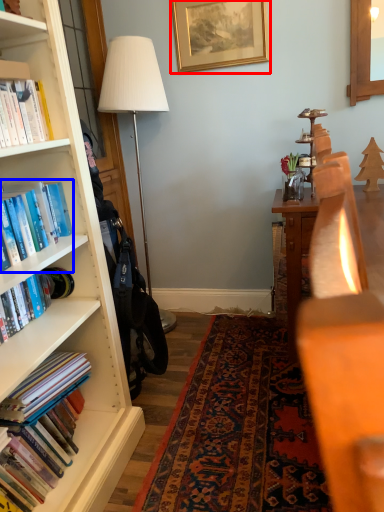
Question: Which object appears closest to the camera in this image, picture frame (highlighted by a red box) or book (highlighted by a blue box)?

Choices:
 (A) picture frame
 (B) book

Answer: (B)